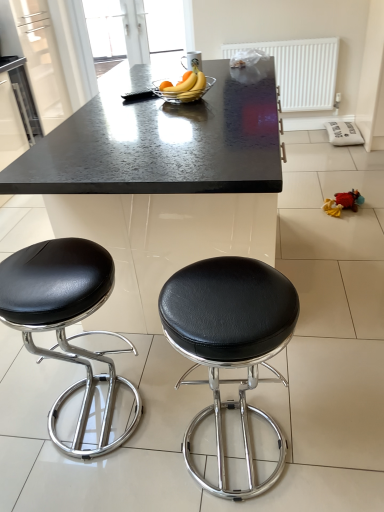
Image resolution: width=384 pixels, height=512 pixels. Describe the element at coordinates (186, 81) in the screenshot. I see `yellow matte banana at center` at that location.

Measure the distance between point (339, 202) and camera.

A distance of 2.76 meters exists between point (339, 202) and camera.

Locate an element on the screen. The height and width of the screenshot is (512, 384). black leather stool at center, placed as the first stool when sorted from right to left is located at coordinates (230, 343).

Describe the element at coordinates (230, 343) in the screenshot. I see `black leather stool at center, the second stool when ordered from left to right` at that location.

Describe the element at coordinates (300, 71) in the screenshot. I see `white textured radiator at upper center` at that location.

Where is `black granite table at center`? black granite table at center is located at coordinates (161, 182).

From the image's perspective, is black granite table at center located above or below black leather stool at left, the 2th stool positioned from the right?

black granite table at center is above black leather stool at left, the 2th stool positioned from the right.

Which of these two, black granite table at center or black leather stool at left, which is the first stool from left to right, is wider?

Wider between the two is black granite table at center.

Which object is closer to the camera taking this photo, black granite table at center or black leather stool at left, which is the first stool from left to right?

black leather stool at left, which is the first stool from left to right, is more forward.

Considering the positions of points (194, 62) and (268, 189), is point (194, 62) farther from camera compared to point (268, 189)?

Yes.

Considering the positions of objects yellow matte banana at center and black granite table at center in the image provided, who is behind, yellow matte banana at center or black granite table at center?

yellow matte banana at center is further away from the camera.

Is the surface of yellow matte banana at center in direct contact with black granite table at center?

yellow matte banana at center and black granite table at center are not in contact.

From a real-world perspective, who is located lower, yellow matte banana at center or black granite table at center?

black granite table at center.

From a real-world perspective, is white textured radiator at upper center positioned over black granite table at center based on gravity?

Indeed, from a real-world perspective, white textured radiator at upper center stands above black granite table at center.

Does white textured radiator at upper center have a greater width compared to black granite table at center?

Incorrect, the width of white textured radiator at upper center does not surpass that of black granite table at center.

You are a GUI agent. You are given a task and a screenshot of the screen. Output one action in this format:
    pyautogui.click(x=<x>, y=<y>)
    Task: Click on the radiator on the right of the black granite table at center
    Image resolution: width=384 pixels, height=512 pixels.
    Given the screenshot: What is the action you would take?
    click(300, 71)

Which object is further away from the camera, white textured radiator at upper center or black leather stool at left, which is the first stool from left to right?

Positioned behind is white textured radiator at upper center.

Choose the correct answer: Is white textured radiator at upper center inside black leather stool at left, which is the first stool from left to right, or outside it?

white textured radiator at upper center is outside black leather stool at left, which is the first stool from left to right.

In the scene shown: In terms of height, does white textured radiator at upper center look taller or shorter compared to black leather stool at left, which is the first stool from left to right?

Considering their sizes, white textured radiator at upper center has less height than black leather stool at left, which is the first stool from left to right.

Is white textured radiator at upper center turned away from black leather stool at left, which is the first stool from left to right?

No, white textured radiator at upper center's orientation is not away from black leather stool at left, which is the first stool from left to right.

From a real-world perspective, who is located higher, red plush toy at lower right or white textured radiator at upper center?

white textured radiator at upper center is physically above.

Is red plush toy at lower right inside or outside of white textured radiator at upper center?

red plush toy at lower right cannot be found inside white textured radiator at upper center.

Which of these two, red plush toy at lower right or white textured radiator at upper center, stands shorter?

Standing shorter between the two is red plush toy at lower right.

From the image's perspective, who appears lower, red plush toy at lower right or yellow matte banana at center?

From the image's view, red plush toy at lower right is below.

Is point (339, 193) positioned after point (189, 83)?

Yes, point (339, 193) is behind point (189, 83).

Does red plush toy at lower right lie behind yellow matte banana at center?

Yes, it is.

From the image's perspective, which is below, black granite table at center or yellow matte banana at center?

black granite table at center.

Is black granite table at center next to yellow matte banana at center and touching it?

black granite table at center is not next to yellow matte banana at center, and they're not touching.

In the image, is black granite table at center positioned in front of or behind yellow matte banana at center?

In the image, black granite table at center appears in front of yellow matte banana at center.

Could you tell me if black granite table at center is facing yellow matte banana at center?

No, black granite table at center does not turn towards yellow matte banana at center.

Where is `the 1st stool in front when counting from the black granite table at center`? the 1st stool in front when counting from the black granite table at center is located at coordinates (64, 320).

In the image, there is a black granite table at center. What are the coordinates of `banana above it (from the image's perspective)` in the screenshot? It's located at (186, 81).

Estimate the real-world distances between objects in this image. Which object is closer to red plush toy at lower right, black leather stool at left, the 2th stool positioned from the right, or black leather stool at center, placed as the first stool when sorted from right to left?

Among the two, black leather stool at center, placed as the first stool when sorted from right to left, is located nearer to red plush toy at lower right.

Which object lies nearer to the anchor point black leather stool at center, placed as the first stool when sorted from right to left, white textured radiator at upper center or red plush toy at lower right?

red plush toy at lower right.

In the scene shown: From the image, which object appears to be farther from black leather stool at left, which is the first stool from left to right, white textured radiator at upper center or black granite table at center?

white textured radiator at upper center lies further to black leather stool at left, which is the first stool from left to right, than the other object.

From the image, which object appears to be nearer to black granite table at center, black leather stool at center, placed as the first stool when sorted from right to left, or white textured radiator at upper center?

black leather stool at center, placed as the first stool when sorted from right to left.

Which object lies nearer to the anchor point yellow matte banana at center, black leather stool at left, which is the first stool from left to right, or white textured radiator at upper center?

Based on the image, black leather stool at left, which is the first stool from left to right, appears to be nearer to yellow matte banana at center.

When comparing their distances from yellow matte banana at center, does black leather stool at left, which is the first stool from left to right, or black leather stool at center, the second stool when ordered from left to right, seem further?

black leather stool at center, the second stool when ordered from left to right, is further to yellow matte banana at center.

When comparing their distances from black leather stool at left, the 2th stool positioned from the right, does yellow matte banana at center or black leather stool at center, the second stool when ordered from left to right, seem further?

yellow matte banana at center is positioned further to the anchor black leather stool at left, the 2th stool positioned from the right.

Estimate the real-world distances between objects in this image. Which object is further from yellow matte banana at center, clear glass bowl at center or red plush toy at lower right?

red plush toy at lower right is further to yellow matte banana at center.

Find the location of a particular element. Image resolution: width=384 pixels, height=512 pixels. stool positioned between black leather stool at center, placed as the first stool when sorted from right to left, and red plush toy at lower right from near to far is located at coordinates (64, 320).

Find the location of a particular element. bowl that lies between yellow matte banana at center and black leather stool at center, the second stool when ordered from left to right, from top to bottom is located at coordinates 183,93.

Where is `banana positioned between black leather stool at left, which is the first stool from left to right, and red plush toy at lower right from near to far`? The width and height of the screenshot is (384, 512). banana positioned between black leather stool at left, which is the first stool from left to right, and red plush toy at lower right from near to far is located at coordinates (186, 81).

Locate an element on the screen. The height and width of the screenshot is (512, 384). stool between clear glass bowl at center and black leather stool at center, placed as the first stool when sorted from right to left, vertically is located at coordinates (64, 320).